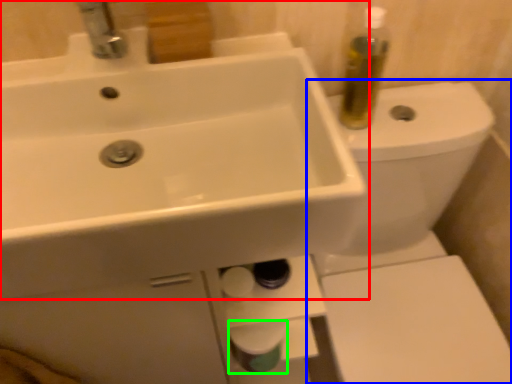
Question: Estimate the real-world distances between objects in this image. Which object is closer to sink (highlighted by a red box), toilet (highlighted by a blue box) or toilet paper (highlighted by a green box)?

Choices:
 (A) toilet
 (B) toilet paper

Answer: (B)